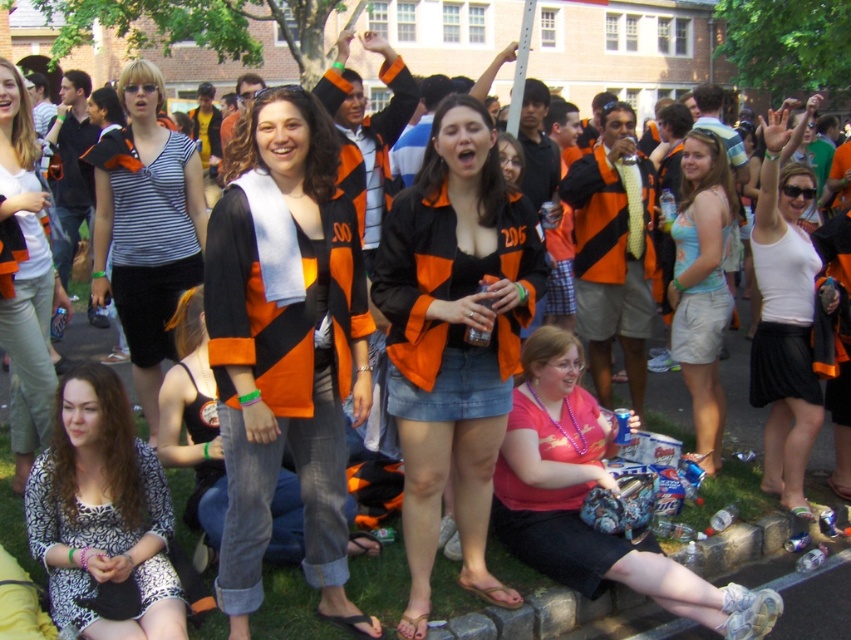
Question: Which object appears farthest from the camera in this image?

Choices:
 (A) orange and black striped jacket at center
 (B) striped fabric shirt at center
 (C) white cotton shirt at center

Answer: (B)

Question: Can you confirm if pink matte shirt at lower center is positioned below striped fabric shirt at center?

Choices:
 (A) yes
 (B) no

Answer: (A)

Question: Is orange matte jacket at center to the right of white matte tank top at upper right from the viewer's perspective?

Choices:
 (A) no
 (B) yes

Answer: (A)

Question: Among these points, which one is nearest to the camera?

Choices:
 (A) (515, 332)
 (B) (3, 81)
 (C) (246, 566)

Answer: (C)

Question: Among these points, which one is nearest to the camera?

Choices:
 (A) (769, 244)
 (B) (420, 486)
 (C) (46, 196)
 (D) (130, 252)

Answer: (B)

Question: Is orange and black striped jacket at center above printed fabric dress at lower left?

Choices:
 (A) yes
 (B) no

Answer: (A)